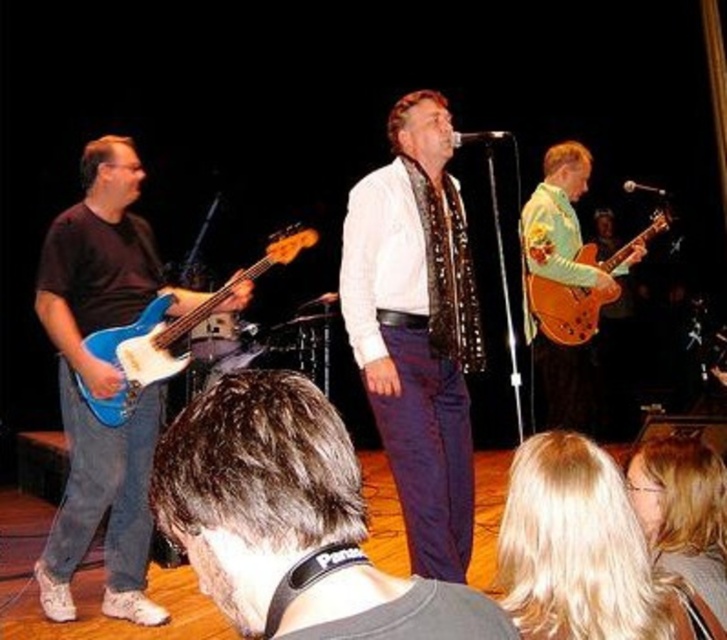
You are an event photographer capturing the live performance. You need to focus your camera on the dark brown hair at center. According to the coordinates provided, where should you aim your camera?

The dark brown hair at center is located at coordinates point (292, 522), so you should aim your camera at that specific point to focus on it.

You are a photographer positioned at the center of the stage. You want to capture a photo that includes both the blonde hair at lower right and the glossy wood guitar at right. Given that your camera has a maximum focus range of 3 meters, will you be able to include both subjects in the same frame without moving the camera?

The blonde hair at lower right and glossy wood guitar at right are 3.08 meters apart. Since the distance exceeds the camera maximum focus range of 3 meters, you will not be able to include both subjects in the same frame without moving the camera.

Based on the scene description, can you determine which object is narrower between the dark brown hair at center and the white textured shirt at center?

The dark brown hair at center is thinner than the white textured shirt at center, so the dark brown hair at center is narrower.